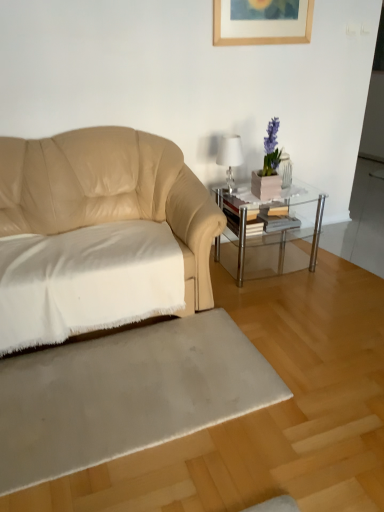
Question: Should I look upward or downward to see silky beige rug at lower center?

Choices:
 (A) down
 (B) up

Answer: (A)

Question: Does white soft fabric at left have a lesser width compared to white glossy table lamp at upper right?

Choices:
 (A) yes
 (B) no

Answer: (B)

Question: Is white soft fabric at left oriented towards white glossy table lamp at upper right?

Choices:
 (A) yes
 (B) no

Answer: (B)

Question: From a real-world perspective, is white soft fabric at left physically below white glossy table lamp at upper right?

Choices:
 (A) no
 (B) yes

Answer: (B)

Question: From a real-world perspective, is white soft fabric at left on top of white glossy table lamp at upper right?

Choices:
 (A) yes
 (B) no

Answer: (B)

Question: Is white soft fabric at left oriented away from white glossy table lamp at upper right?

Choices:
 (A) yes
 (B) no

Answer: (B)

Question: Are white soft fabric at left and white glossy table lamp at upper right far apart?

Choices:
 (A) yes
 (B) no

Answer: (A)

Question: From the image's perspective, is clear glass table at center located above white glossy table lamp at upper right?

Choices:
 (A) yes
 (B) no

Answer: (B)

Question: Does clear glass table at center contain white glossy table lamp at upper right?

Choices:
 (A) no
 (B) yes

Answer: (A)

Question: Can you confirm if clear glass table at center is positioned to the right of white glossy table lamp at upper right?

Choices:
 (A) yes
 (B) no

Answer: (A)

Question: Does clear glass table at center appear on the left side of white glossy table lamp at upper right?

Choices:
 (A) yes
 (B) no

Answer: (B)

Question: Can you confirm if clear glass table at center is thinner than white glossy table lamp at upper right?

Choices:
 (A) no
 (B) yes

Answer: (A)

Question: From the image's perspective, is clear glass table at center below white glossy table lamp at upper right?

Choices:
 (A) yes
 (B) no

Answer: (A)

Question: Is silky beige rug at lower center bigger than white soft fabric at left?

Choices:
 (A) yes
 (B) no

Answer: (B)